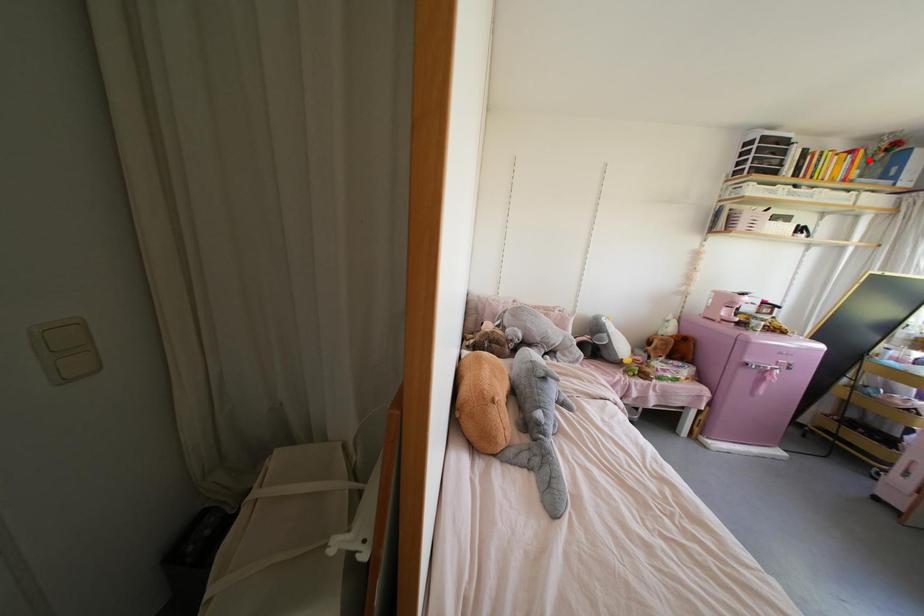
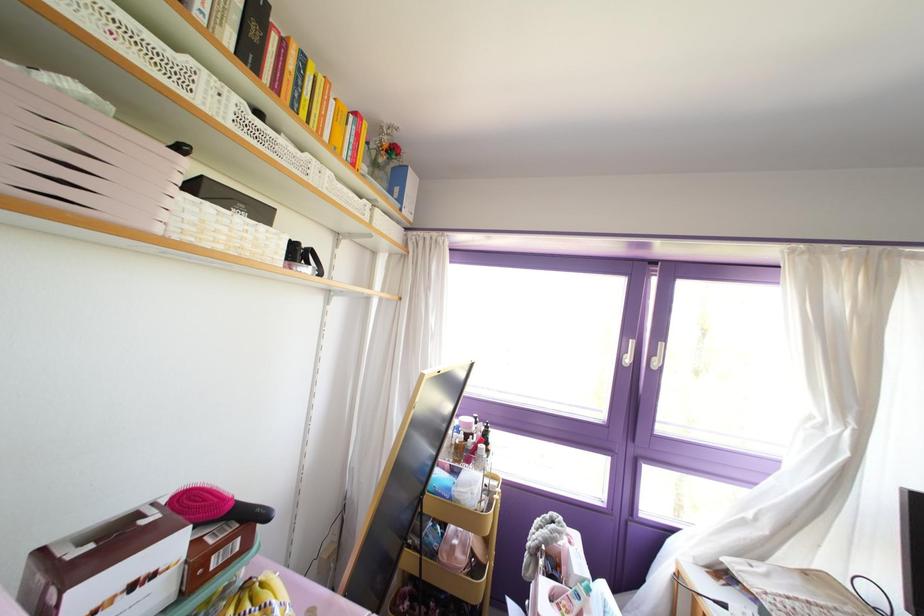
In the second image, find the point that corresponds to the highlighted location in the first image.

(372, 163)